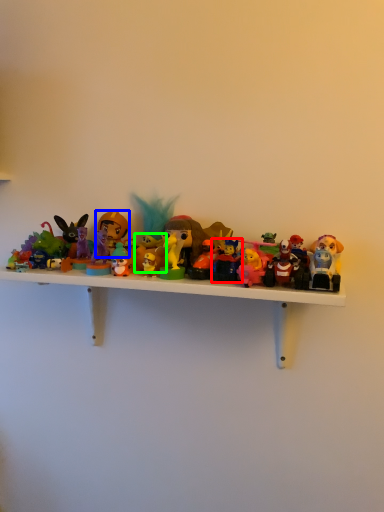
Question: Based on their relative distances, which object is nearer to toy (highlighted by a red box)? Choose from toy (highlighted by a blue box) and toy (highlighted by a green box).

Choices:
 (A) toy
 (B) toy

Answer: (B)